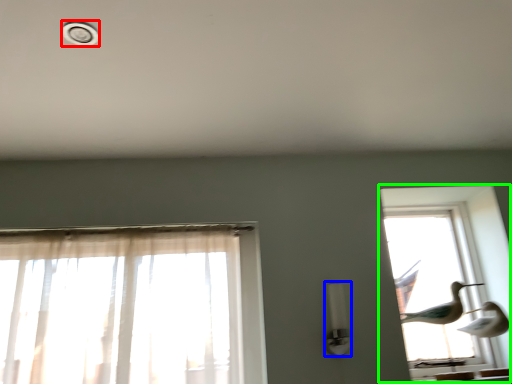
Question: Which object is positioned farthest from dot (highlighted by a red box)? Select from light fixture (highlighted by a blue box) and window (highlighted by a green box).

Choices:
 (A) light fixture
 (B) window

Answer: (B)